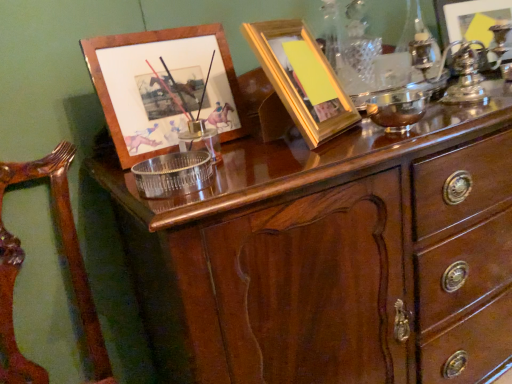
Where is `free spot to the right of wooden picture frame at upper left, positioned as the 1th picture frame in left-to-right order`? The height and width of the screenshot is (384, 512). free spot to the right of wooden picture frame at upper left, positioned as the 1th picture frame in left-to-right order is located at coordinates (261, 146).